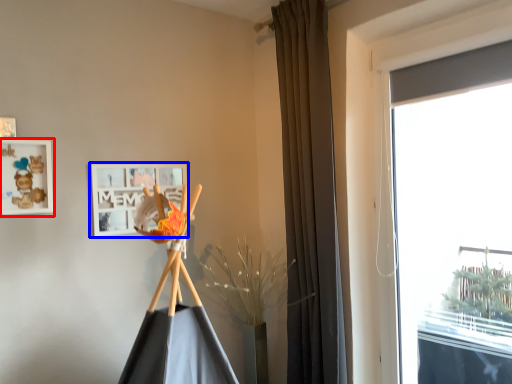
Question: Which of the following is the closest to the observer, picture frame (highlighted by a red box) or picture frame (highlighted by a blue box)?

Choices:
 (A) picture frame
 (B) picture frame

Answer: (A)